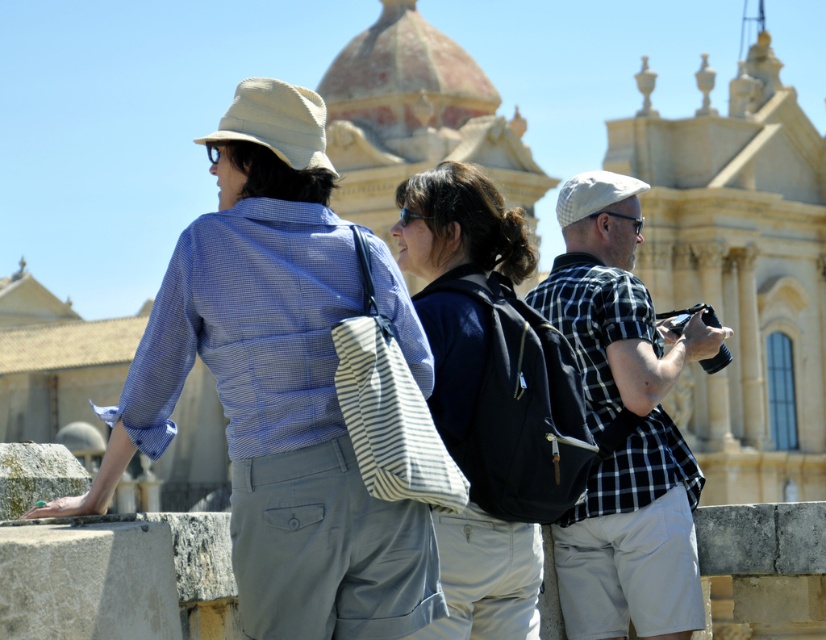
You are a tour guide who needs to ensure that all tourists in the group can hear your explanation. You are standing near the camera. Which tourist, the matte blue shirt at center or the person holding the camera, is farther away from you?

The matte blue shirt at center is farther away from you because they are 142.92 feet apart from the camera, which you are near.

You are a photographer trying to capture a candid shot of the matte blue shirt at center and the dark blue backpack at center. Since the backpack is taller than the shirt, where should you position your camera to ensure both are fully visible in the frame?

Since the dark blue backpack at center is taller than the matte blue shirt at center, you should position your camera lower to include the full height of the backpack while still capturing the shirt.